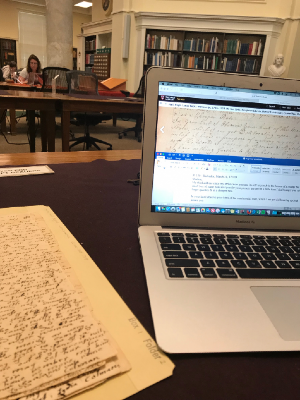
Where is `bookshelf`? This screenshot has width=300, height=400. bookshelf is located at coordinates click(162, 21).